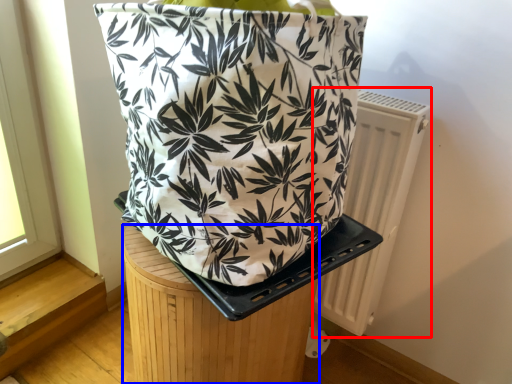
Question: Which object is closer to the camera taking this photo, radiator (highlighted by a red box) or furniture (highlighted by a blue box)?

Choices:
 (A) radiator
 (B) furniture

Answer: (B)